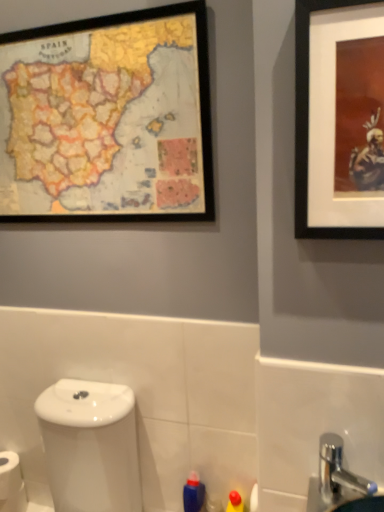
Question: Is black matte picture frame at upper right, which is counted as the first picture frame, starting from the front, completely or partially inside wooden map at upper left, acting as the 1th picture frame starting from the left?

Choices:
 (A) no
 (B) yes

Answer: (A)

Question: From the image's perspective, is wooden map at upper left, acting as the 1th picture frame starting from the left, located beneath black matte picture frame at upper right, which is counted as the second picture frame, starting from the left?

Choices:
 (A) no
 (B) yes

Answer: (A)

Question: Does wooden map at upper left, acting as the first picture frame starting from the back, touch black matte picture frame at upper right, which is the 1th picture frame from right to left?

Choices:
 (A) yes
 (B) no

Answer: (B)

Question: Does wooden map at upper left, which is counted as the 2th picture frame, starting from the front, have a smaller size compared to black matte picture frame at upper right, which is the 1th picture frame from right to left?

Choices:
 (A) yes
 (B) no

Answer: (B)

Question: Considering the relative sizes of wooden map at upper left, which is counted as the 2th picture frame, starting from the front, and black matte picture frame at upper right, the second picture frame positioned from the back, in the image provided, is wooden map at upper left, which is counted as the 2th picture frame, starting from the front, wider than black matte picture frame at upper right, the second picture frame positioned from the back,?

Choices:
 (A) no
 (B) yes

Answer: (A)

Question: Is wooden map at upper left, which is counted as the 2th picture frame, starting from the front, completely or partially outside of black matte picture frame at upper right, which is counted as the first picture frame, starting from the front?

Choices:
 (A) yes
 (B) no

Answer: (A)

Question: Does white glossy toilet at lower left have a lesser height compared to black matte picture frame at upper right, which is counted as the second picture frame, starting from the left?

Choices:
 (A) no
 (B) yes

Answer: (A)

Question: Can we say white glossy toilet at lower left lies outside black matte picture frame at upper right, which is the 1th picture frame from right to left?

Choices:
 (A) no
 (B) yes

Answer: (B)

Question: Is white glossy toilet at lower left wider than black matte picture frame at upper right, which is the 1th picture frame from right to left?

Choices:
 (A) yes
 (B) no

Answer: (A)

Question: Is black matte picture frame at upper right, which is the 1th picture frame from right to left, a part of white glossy toilet at lower left?

Choices:
 (A) no
 (B) yes

Answer: (A)

Question: Considering the relative positions of white glossy toilet at lower left and black matte picture frame at upper right, which is counted as the first picture frame, starting from the front, in the image provided, is white glossy toilet at lower left to the right of black matte picture frame at upper right, which is counted as the first picture frame, starting from the front, from the viewer's perspective?

Choices:
 (A) yes
 (B) no

Answer: (B)

Question: Is white glossy toilet at lower left closer to the viewer compared to black matte picture frame at upper right, which is the 1th picture frame from right to left?

Choices:
 (A) yes
 (B) no

Answer: (B)

Question: Can you confirm if wooden map at upper left, acting as the 1th picture frame starting from the left, is wider than silver metallic faucet at lower right?

Choices:
 (A) yes
 (B) no

Answer: (B)